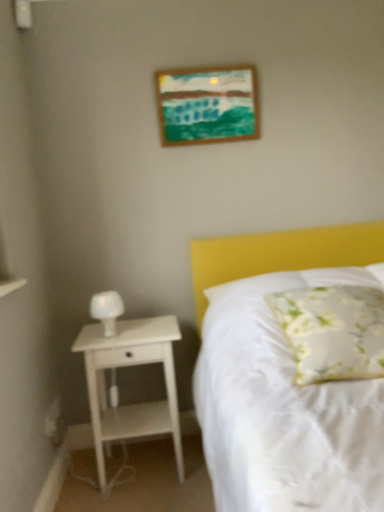
Question: From the image's perspective, relative to floral fabric pillow at center, is wooden picture frame at upper center above or below?

Choices:
 (A) below
 (B) above

Answer: (B)

Question: Considering the positions of point (233, 112) and point (301, 354), is point (233, 112) closer or farther from the camera than point (301, 354)?

Choices:
 (A) closer
 (B) farther

Answer: (B)

Question: Which is nearer to the wooden picture frame at upper center?

Choices:
 (A) white wood nightstand at left
 (B) floral fabric pillow at center
 (C) white matte bedside lamp at left

Answer: (C)

Question: Which object is the farthest from the floral fabric pillow at center?

Choices:
 (A) white matte bedside lamp at left
 (B) white wood nightstand at left
 (C) wooden picture frame at upper center

Answer: (C)